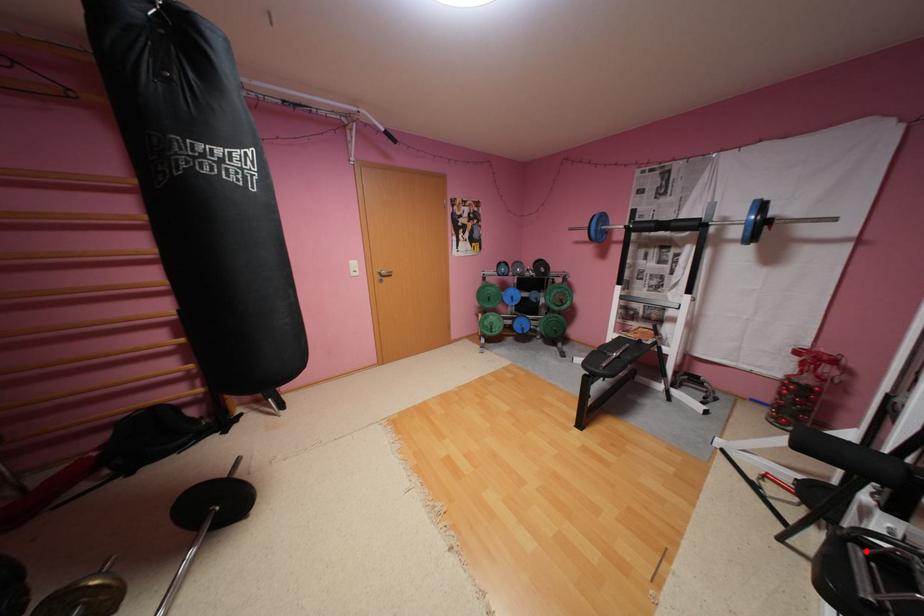
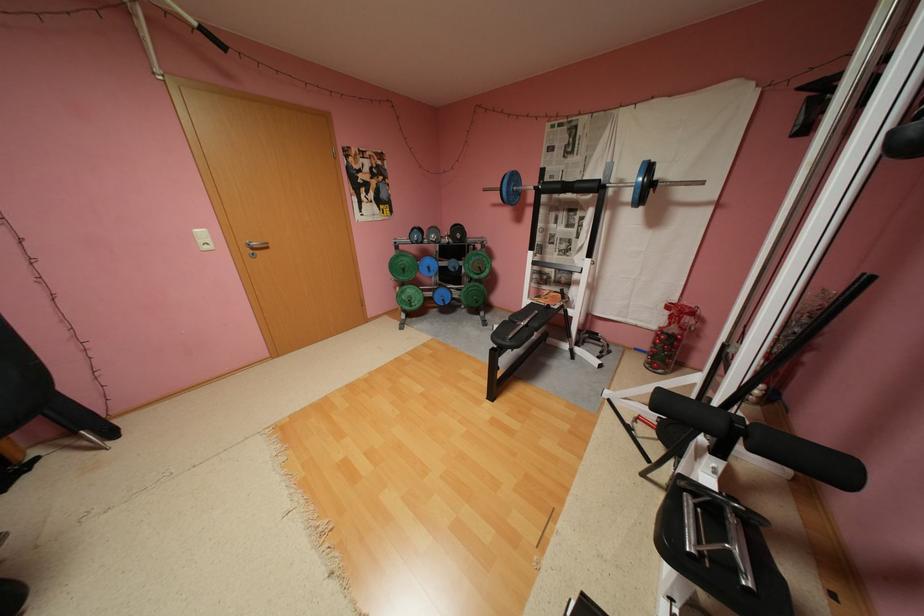
Find the pixel in the second image that matches the highlighted location in the first image.

(699, 500)